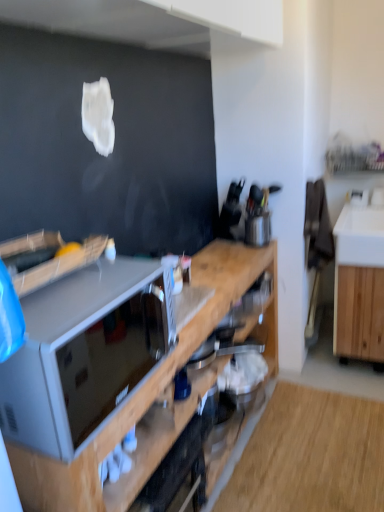
Describe the element at coordinates (177, 472) in the screenshot. I see `metallic silver toaster at center, the first appliance from the front` at that location.

Find the location of a particular element. This screenshot has width=384, height=512. wooden cabinet at center, placed as the second cabinetry when sorted from right to left is located at coordinates (148, 382).

The height and width of the screenshot is (512, 384). Describe the element at coordinates (258, 228) in the screenshot. I see `metallic silver knife block at upper center, the 1th appliance in the top-to-bottom sequence` at that location.

The height and width of the screenshot is (512, 384). Find the location of `metallic silver toaster at center, which is the 2th appliance from back to front`. metallic silver toaster at center, which is the 2th appliance from back to front is located at coordinates (177, 472).

How many degrees apart are the facing directions of metallic silver toaster at center, marked as the 2th appliance in a right-to-left arrangement, and matte gray microwave at center?

0.337 degrees separate the facing orientations of metallic silver toaster at center, marked as the 2th appliance in a right-to-left arrangement, and matte gray microwave at center.

Is point (201, 479) closer or farther from the camera than point (74, 311)?

Point (201, 479) appears to be farther away from the viewer than point (74, 311).

Can you see metallic silver toaster at center, the first appliance from the front, touching matte gray microwave at center?

No, metallic silver toaster at center, the first appliance from the front, is not with matte gray microwave at center.

Is metallic silver toaster at center, marked as the 2th appliance in a right-to-left arrangement, positioned in front of matte gray microwave at center?

No, metallic silver toaster at center, marked as the 2th appliance in a right-to-left arrangement, is further to the viewer.

Is metallic silver toaster at center, the second appliance in the top-to-bottom sequence, not near wooden cabinet at center, placed as the second cabinetry when sorted from right to left?

No.

From their relative heights in the image, would you say metallic silver toaster at center, the second appliance in the top-to-bottom sequence, is taller or shorter than wooden cabinet at center, which appears as the first cabinetry when viewed from the left?

Clearly, metallic silver toaster at center, the second appliance in the top-to-bottom sequence, is shorter compared to wooden cabinet at center, which appears as the first cabinetry when viewed from the left.

From the image's perspective, is metallic silver toaster at center, which is the 2th appliance from back to front, above wooden cabinet at center, which appears as the first cabinetry when viewed from the left?

No.

From a real-world perspective, is metallic silver toaster at center, which is the 2th appliance from back to front, positioned above or below wooden cabinet at center, placed as the second cabinetry when sorted from right to left?

metallic silver toaster at center, which is the 2th appliance from back to front, is situated higher than wooden cabinet at center, placed as the second cabinetry when sorted from right to left, in the real world.

Locate an element on the screen. the 1st cabinetry to the right of the matte gray microwave at center, starting your count from the anchor is located at coordinates (148, 382).

Is matte gray microwave at center with wooden cabinet at center, which appears as the first cabinetry when viewed from the left?

matte gray microwave at center and wooden cabinet at center, which appears as the first cabinetry when viewed from the left, are clearly separated.

Is matte gray microwave at center in front of or behind wooden cabinet at center, placed as the second cabinetry when sorted from right to left, in the image?

Clearly, matte gray microwave at center is in front of wooden cabinet at center, placed as the second cabinetry when sorted from right to left.

Does matte gray microwave at center have a greater height compared to wooden cabinet at center, placed as the second cabinetry when sorted from right to left?

In fact, matte gray microwave at center may be shorter than wooden cabinet at center, placed as the second cabinetry when sorted from right to left.

Considering the relative sizes of wooden cabinet at center, which appears as the first cabinetry when viewed from the left, and wooden cabinet at right, positioned as the 2th cabinetry in left-to-right order, in the image provided, is wooden cabinet at center, which appears as the first cabinetry when viewed from the left, shorter than wooden cabinet at right, positioned as the 2th cabinetry in left-to-right order,?

No, wooden cabinet at center, which appears as the first cabinetry when viewed from the left, is not shorter than wooden cabinet at right, positioned as the 2th cabinetry in left-to-right order.

Between wooden cabinet at center, which appears as the first cabinetry when viewed from the left, and wooden cabinet at right, positioned as the 2th cabinetry in left-to-right order, which one appears on the right side from the viewer's perspective?

From the viewer's perspective, wooden cabinet at right, positioned as the 2th cabinetry in left-to-right order, appears more on the right side.

Which is farther, (49, 483) or (368, 303)?

The point (368, 303) is behind.

Could you measure the distance between wooden cabinet at center, which appears as the first cabinetry when viewed from the left, and wooden cabinet at right, positioned as the 2th cabinetry in left-to-right order?

A distance of 23.28 inches exists between wooden cabinet at center, which appears as the first cabinetry when viewed from the left, and wooden cabinet at right, positioned as the 2th cabinetry in left-to-right order.

Is wooden cabinet at right, the 1th cabinetry viewed from the right, far away from wooden cabinet at center, placed as the second cabinetry when sorted from right to left?

That's not correct — wooden cabinet at right, the 1th cabinetry viewed from the right, is a little close to wooden cabinet at center, placed as the second cabinetry when sorted from right to left.

Is wooden cabinet at right, positioned as the 2th cabinetry in left-to-right order, facing away from wooden cabinet at center, which appears as the first cabinetry when viewed from the left?

wooden cabinet at right, positioned as the 2th cabinetry in left-to-right order, is not turned away from wooden cabinet at center, which appears as the first cabinetry when viewed from the left.

Considering the relative sizes of wooden cabinet at right, the 1th cabinetry viewed from the right, and wooden cabinet at center, placed as the second cabinetry when sorted from right to left, in the image provided, is wooden cabinet at right, the 1th cabinetry viewed from the right, thinner than wooden cabinet at center, placed as the second cabinetry when sorted from right to left,?

No, wooden cabinet at right, the 1th cabinetry viewed from the right, is not thinner than wooden cabinet at center, placed as the second cabinetry when sorted from right to left.

Does metallic silver toaster at center, which is the 2th appliance from back to front, touch wooden cabinet at right, the 1th cabinetry viewed from the right?

No, metallic silver toaster at center, which is the 2th appliance from back to front, is not next to wooden cabinet at right, the 1th cabinetry viewed from the right.

Would you say wooden cabinet at right, positioned as the 2th cabinetry in left-to-right order, is part of metallic silver toaster at center, which is the first appliance in bottom-to-top order,'s contents?

No, metallic silver toaster at center, which is the first appliance in bottom-to-top order, does not contain wooden cabinet at right, positioned as the 2th cabinetry in left-to-right order.

What's the angular difference between metallic silver toaster at center, which is counted as the 1th appliance, starting from the left, and wooden cabinet at right, positioned as the 2th cabinetry in left-to-right order,'s facing directions?

89.3 degrees separate the facing orientations of metallic silver toaster at center, which is counted as the 1th appliance, starting from the left, and wooden cabinet at right, positioned as the 2th cabinetry in left-to-right order.

Which is in front, point (145, 489) or point (365, 342)?

Positioned in front is point (145, 489).

Which of these two, wooden cabinet at right, positioned as the 2th cabinetry in left-to-right order, or matte gray microwave at center, stands taller?

With more height is wooden cabinet at right, positioned as the 2th cabinetry in left-to-right order.

Is wooden cabinet at right, positioned as the 2th cabinetry in left-to-right order, next to matte gray microwave at center?

wooden cabinet at right, positioned as the 2th cabinetry in left-to-right order, and matte gray microwave at center are clearly separated.

Is wooden cabinet at right, positioned as the 2th cabinetry in left-to-right order, not within matte gray microwave at center?

Yes, wooden cabinet at right, positioned as the 2th cabinetry in left-to-right order, is not within matte gray microwave at center.

This screenshot has width=384, height=512. I want to click on microwave oven to the left of metallic silver toaster at center, which is the 2th appliance from back to front, so click(x=84, y=351).

Starting from the wooden cabinet at center, which appears as the first cabinetry when viewed from the left, which appliance is the 1st one behind? Please provide its 2D coordinates.

[(177, 472)]

Which object lies nearer to the anchor point metallic silver toaster at center, which is the 2th appliance from back to front, wooden cabinet at center, which appears as the first cabinetry when viewed from the left, or wooden cabinet at right, the 1th cabinetry viewed from the right?

wooden cabinet at center, which appears as the first cabinetry when viewed from the left, is closer to metallic silver toaster at center, which is the 2th appliance from back to front.

When comparing their distances from matte gray microwave at center, does metallic silver knife block at upper center, the 1th appliance in the top-to-bottom sequence, or metallic silver toaster at center, the second appliance in the top-to-bottom sequence, seem further?

metallic silver knife block at upper center, the 1th appliance in the top-to-bottom sequence, lies further to matte gray microwave at center than the other object.

Which object lies nearer to the anchor point wooden cabinet at right, the 1th cabinetry viewed from the right, metallic silver knife block at upper center, which ranks as the first appliance in right-to-left order, or metallic silver toaster at center, which is the 2th appliance from back to front?

The object closer to wooden cabinet at right, the 1th cabinetry viewed from the right, is metallic silver knife block at upper center, which ranks as the first appliance in right-to-left order.

Estimate the real-world distances between objects in this image. Which object is further from metallic silver knife block at upper center, which ranks as the first appliance in right-to-left order, wooden cabinet at right, positioned as the 2th cabinetry in left-to-right order, or metallic silver toaster at center, marked as the 2th appliance in a right-to-left arrangement?

metallic silver toaster at center, marked as the 2th appliance in a right-to-left arrangement.

From the image, which object appears to be farther from matte gray microwave at center, wooden cabinet at right, positioned as the 2th cabinetry in left-to-right order, or metallic silver knife block at upper center, the 2th appliance when ordered from left to right?

wooden cabinet at right, positioned as the 2th cabinetry in left-to-right order, lies further to matte gray microwave at center than the other object.

Which object lies nearer to the anchor point wooden cabinet at right, positioned as the 2th cabinetry in left-to-right order, metallic silver toaster at center, the second appliance in the top-to-bottom sequence, or matte gray microwave at center?

metallic silver toaster at center, the second appliance in the top-to-bottom sequence.

Based on their spatial positions, is metallic silver knife block at upper center, the 2th appliance when ordered from left to right, or matte gray microwave at center further from wooden cabinet at center, which appears as the first cabinetry when viewed from the left?

Based on the image, metallic silver knife block at upper center, the 2th appliance when ordered from left to right, appears to be further to wooden cabinet at center, which appears as the first cabinetry when viewed from the left.

Estimate the real-world distances between objects in this image. Which object is closer to wooden cabinet at center, which appears as the first cabinetry when viewed from the left, metallic silver knife block at upper center, the second appliance positioned from the bottom, or wooden cabinet at right, positioned as the 2th cabinetry in left-to-right order?

The object closer to wooden cabinet at center, which appears as the first cabinetry when viewed from the left, is metallic silver knife block at upper center, the second appliance positioned from the bottom.

The width and height of the screenshot is (384, 512). In order to click on appliance between wooden cabinet at center, which appears as the first cabinetry when viewed from the left, and metallic silver knife block at upper center, which appears as the 2th appliance when viewed from the front, along the z-axis in this screenshot , I will do `click(177, 472)`.

At what (x,y) coordinates should I click in order to perform the action: click on appliance between matte gray microwave at center and metallic silver knife block at upper center, the second appliance positioned from the bottom, along the z-axis. Please return your answer as a coordinate pair (x, y). The width and height of the screenshot is (384, 512). Looking at the image, I should click on point(177,472).

Where is `cabinetry located between metallic silver toaster at center, the second appliance in the top-to-bottom sequence, and wooden cabinet at right, the 1th cabinetry viewed from the right, in the left-right direction`? The width and height of the screenshot is (384, 512). cabinetry located between metallic silver toaster at center, the second appliance in the top-to-bottom sequence, and wooden cabinet at right, the 1th cabinetry viewed from the right, in the left-right direction is located at coordinates (148, 382).

Where is `cabinetry between matte gray microwave at center and metallic silver knife block at upper center, which ranks as the first appliance in right-to-left order, from front to back`? The height and width of the screenshot is (512, 384). cabinetry between matte gray microwave at center and metallic silver knife block at upper center, which ranks as the first appliance in right-to-left order, from front to back is located at coordinates click(x=148, y=382).